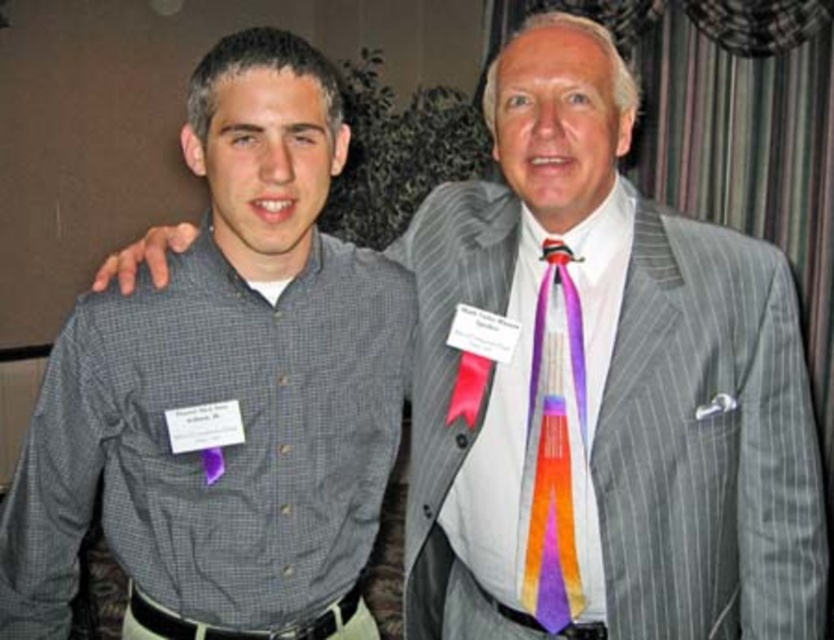
You are a photographer at a formal event. You need to place a small microphone stand exactly at the center point between the gray checkered shirt at left and another object. What is the coordinate of the center point if the other object is located at point 0.389, 0.729?

The center point between the gray checkered shirt at left at point (225, 390) and the other object at point (606, 248) is calculated by averaging the x and y coordinates. The x coordinate is 0.611 and 0.389, so the average is 0.5. The y coordinate is 0.271 and 0.729, so the average is 0.5. Therefore, the center point is at (417, 320).

You are taking a photo of two people standing in a room. You want to focus on the person closer to the camera. Which point should you aim your camera at, point (415, 364) or point (566, 417)?

Point (415, 364) is further to the camera than point (566, 417), so you should aim your camera at point (415, 364) to focus on the person closer to the camera.

You are a photographer setting up for a group photo. You need to ensure that all participants are visible. Given the gray checkered shirt at left and the multicolored silk tie at center, which one might require more space to the left to avoid being cut off?

The gray checkered shirt at left might require more space to the left since it is wider than the multicolored silk tie at center, so positioning it further left would prevent it from being cut off.